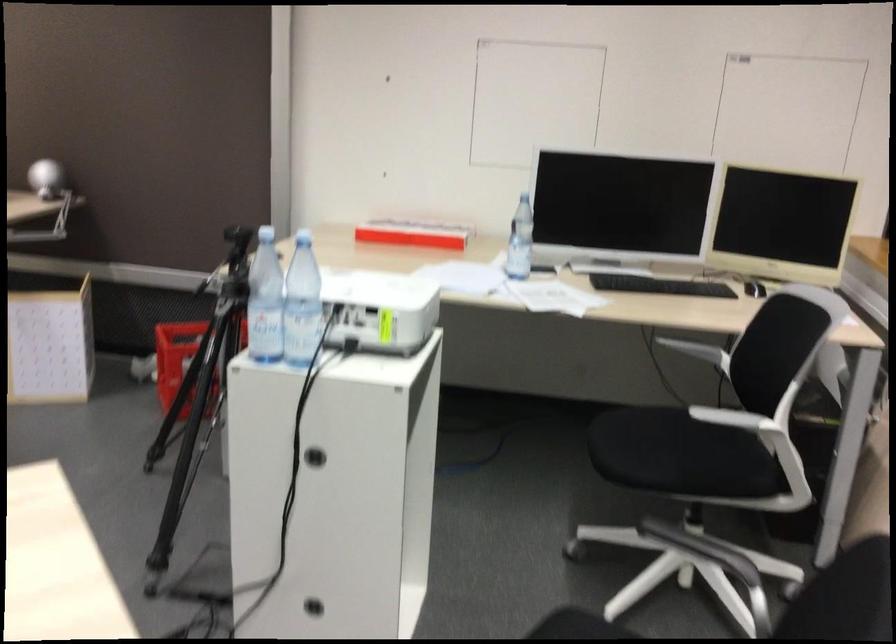
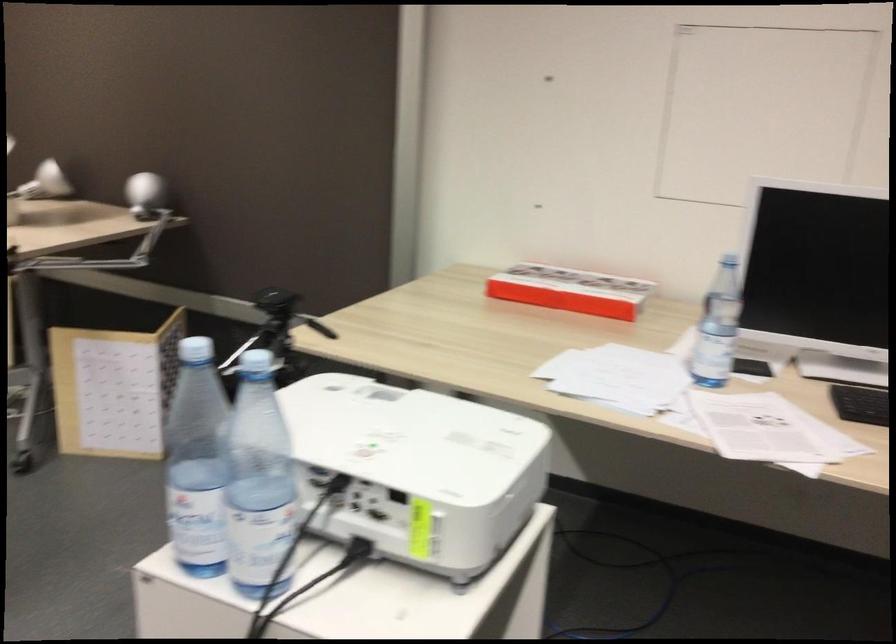
Question: I am providing you with two images of the same scene from different viewpoints. Please identify which objects are invisible in image2.

Choices:
 (A) camera tripod
 (B) clear plastic bottle
 (C) whiteboard caster wheel
 (D) tripod adjustment handle

Answer: (A)